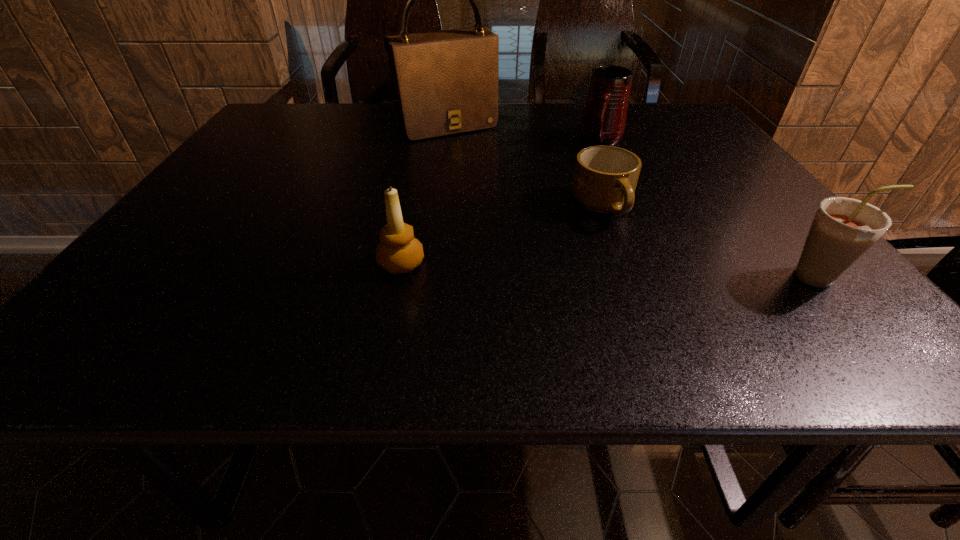
The height and width of the screenshot is (540, 960). I want to click on candle_holder, so click(398, 252).

The width and height of the screenshot is (960, 540). Identify the location of root beer. (844, 229).

Where is `the taller mug`? This screenshot has width=960, height=540. the taller mug is located at coordinates (603, 120).

Locate an element on the screen. The height and width of the screenshot is (540, 960). the shortest object is located at coordinates (605, 178).

Identify the location of the third farthest object. The image size is (960, 540). (605, 178).

Identify the location of shoulder bag. This screenshot has width=960, height=540. (445, 82).

Image resolution: width=960 pixels, height=540 pixels. Identify the location of vacant area located 0.350m on the right of the candle_holder. (611, 264).

The height and width of the screenshot is (540, 960). I want to click on free space located 0.220m on the side of the taller mug with the handle, so click(583, 194).

Image resolution: width=960 pixels, height=540 pixels. Identify the location of free point located 0.280m on the side of the taller mug with the handle. (577, 208).

At what (x,y) coordinates should I click in order to perform the action: click on free region located on the side of the taller mug with the handle. Please return your answer as a coordinate pair (x, y). Image resolution: width=960 pixels, height=540 pixels. Looking at the image, I should click on (593, 167).